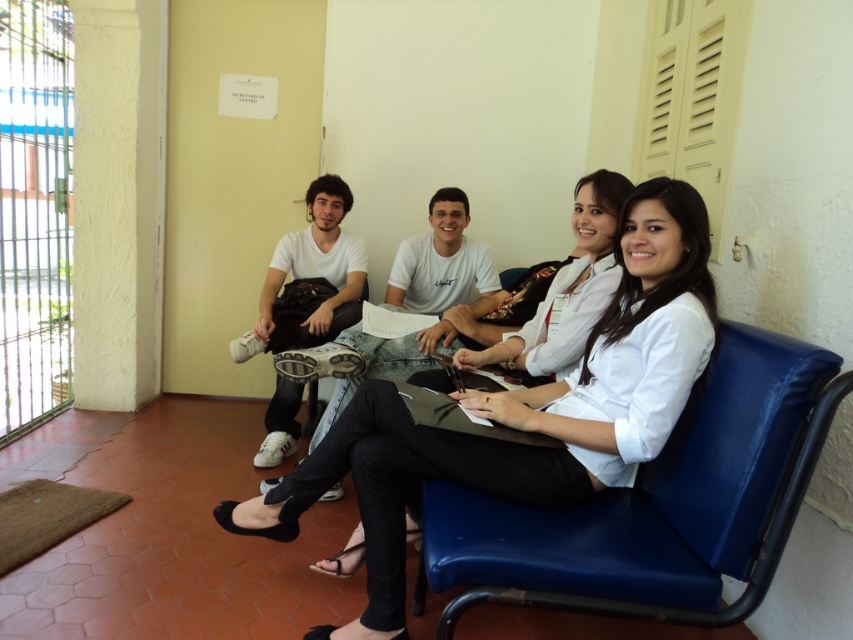
You are designing a layout for a small waiting area and need to place the blue leather chair at center and the white matte shirt at center next to each other. Based on their dimensions, which one should you place on the side with limited space?

The blue leather chair at center is thinner than the white matte shirt at center, so it should be placed on the side with limited space since it requires less width.

Consider the image. You are standing in the waiting area and need to locate the person wearing the white matte shirt at center and the one with white matte sneakers at left. From your perspective, which object is positioned to the right of the other?

The white matte shirt at center is to the right of the white matte sneakers at left.

You are standing at the origin point of the coordinate system in the waiting area. You need to walk to the blue leather chair at center. What are the coordinates you need to move to?

The coordinates to reach the blue leather chair at center are at point (x=656, y=502).